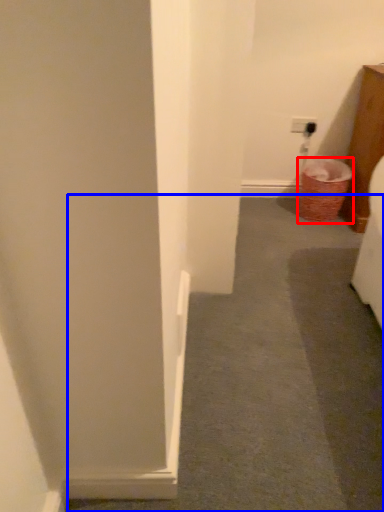
Question: Which object appears farthest to the camera in this image, laundry basket (highlighted by a red box) or path (highlighted by a blue box)?

Choices:
 (A) laundry basket
 (B) path

Answer: (A)